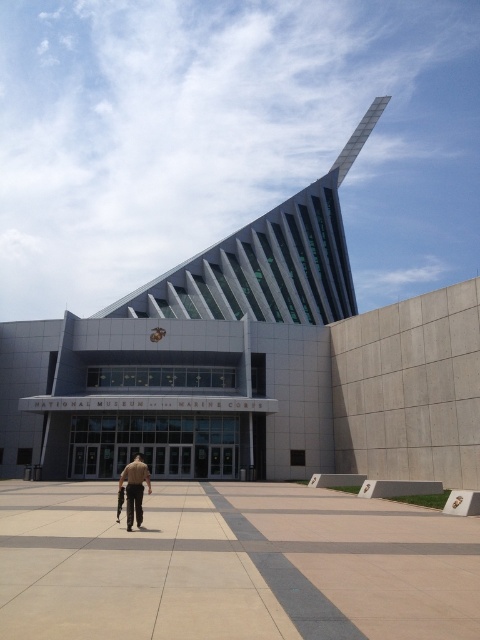
In the scene shown: You are standing at the entrance of the National Museum of the Marine Corps and want to walk to the beige concrete pavement at center. Which direction should you head?

The beige concrete pavement at center is located at point (231, 564), so you should head towards the center of the image to reach it.

In the scene shown: You are standing in front of the National Museum of the Marine Corps and see the beige concrete pavement at center and the tan uniform at center. Which object is located to the right of the other?

The beige concrete pavement at center is positioned on the right side of tan uniform at center.

You are standing at the entrance of the National Museum of the Marine Corps and see the beige concrete pavement at center and the tan uniform at center. Which object is taller?

The tan uniform at center is taller than the beige concrete pavement at center.